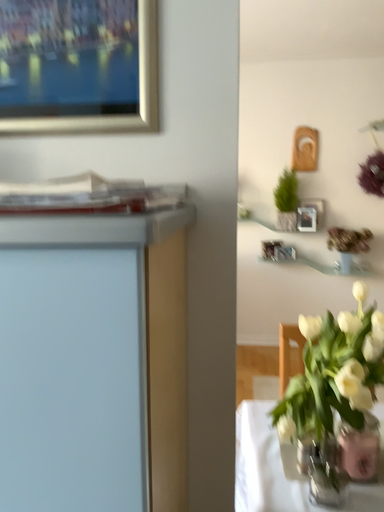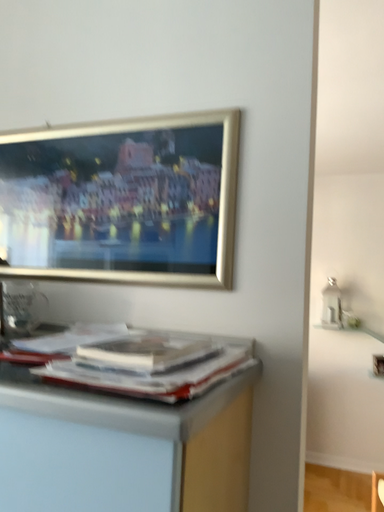
Question: How did the camera likely rotate when shooting the video?

Choices:
 (A) rotated downward
 (B) rotated upward

Answer: (B)